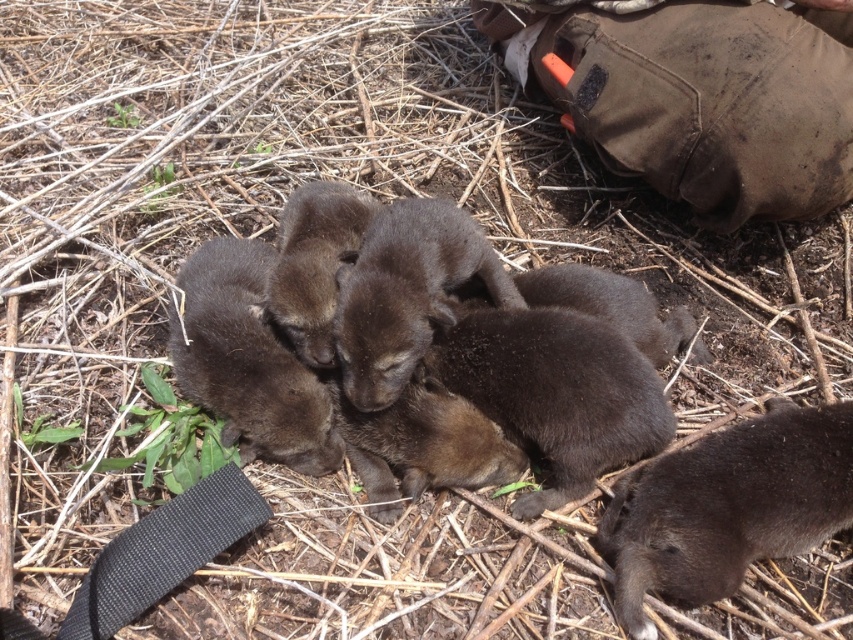
Does brown canvas pants at upper right have a lesser width compared to brown fur at lower right?

No, brown canvas pants at upper right is not thinner than brown fur at lower right.

Is the position of brown canvas pants at upper right more distant than that of brown fur at lower right?

Yes, it is.

Who is more distant from viewer, (750, 170) or (618, 536)?

Point (750, 170)

Find the location of a particular element. This screenshot has height=640, width=853. brown canvas pants at upper right is located at coordinates (699, 93).